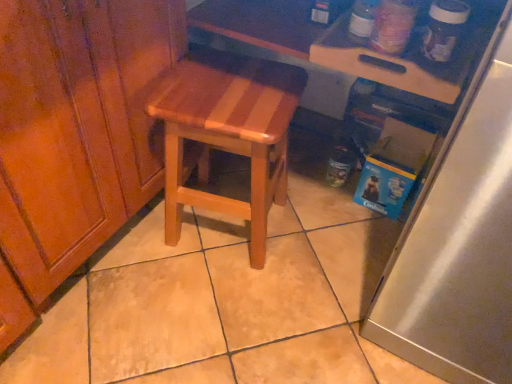
Find the location of `free spot above wooden at center (from a real-world perspective)`. free spot above wooden at center (from a real-world perspective) is located at coordinates (230, 91).